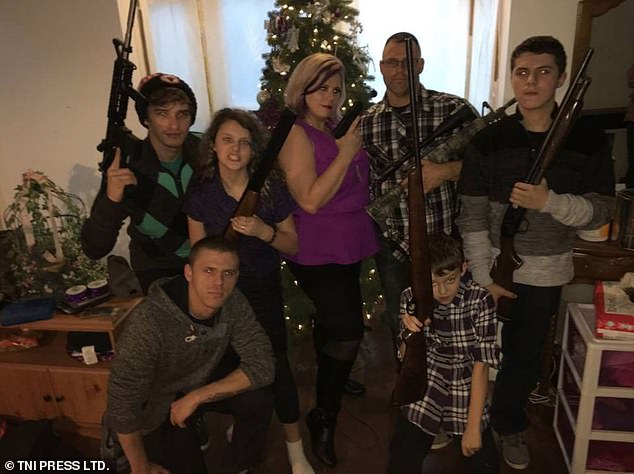
Where is `christmas tree`? christmas tree is located at coordinates (311, 26).